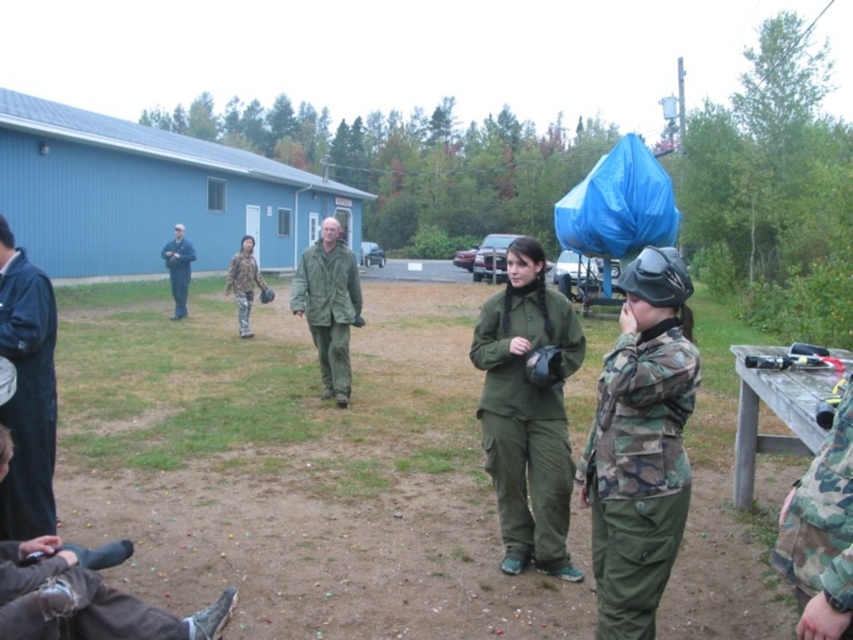
What is located at the point with coordinates (637,474) in the image?

The point at coordinates (637,474) indicates the location of the camo fabric uniform at center.

You are a photographer trying to capture both the camo fabric uniform at center and the camo fabric uniform at right in a single frame. Since you want to ensure both are in focus, you need to know their relative sizes. Which uniform is narrower in width?

The camo fabric uniform at center is thinner than the camo fabric uniform at right, so the camo fabric uniform at center is narrower in width.